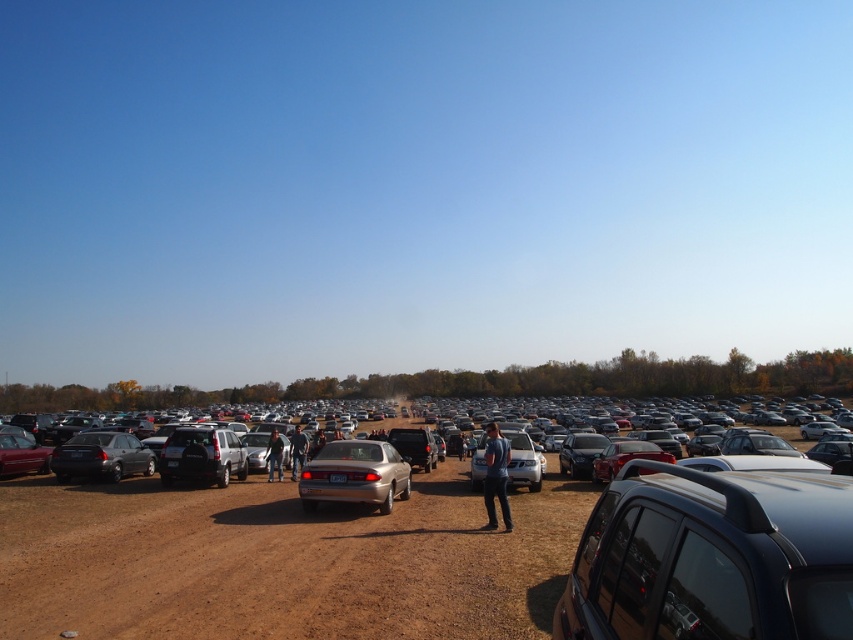
Question: Which of the following is the closest to the observer?

Choices:
 (A) (751, 476)
 (B) (112, 444)

Answer: (A)

Question: Which point appears closest to the camera in this image?

Choices:
 (A) (82, 444)
 (B) (294, 464)
 (C) (280, 442)
 (D) (573, 460)

Answer: (A)

Question: Can you confirm if gold metallic sedan at center is positioned to the left of matte black suv at center?

Choices:
 (A) no
 (B) yes

Answer: (A)

Question: Which point is closer to the camera?

Choices:
 (A) (416, 477)
 (B) (538, 486)
 (C) (84, 449)

Answer: (C)

Question: Can you confirm if shiny black suv at right is thinner than white matte sedan at center?

Choices:
 (A) yes
 (B) no

Answer: (A)

Question: Can you confirm if shiny silver car at center is positioned to the left of gold metallic sedan at center?

Choices:
 (A) yes
 (B) no

Answer: (B)